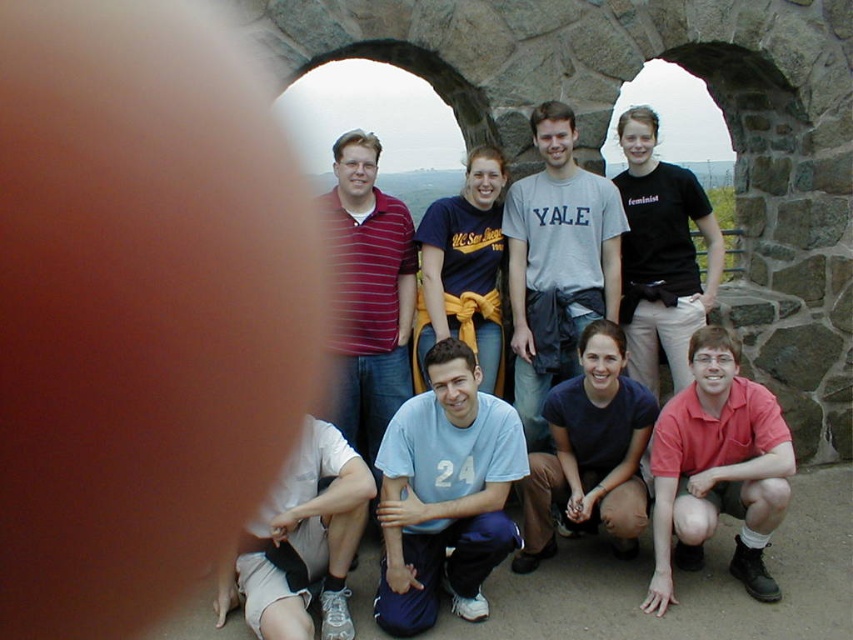
Can you confirm if red cotton shirt at lower right is bigger than black matte shirt at upper center?

Correct, red cotton shirt at lower right is larger in size than black matte shirt at upper center.

The image size is (853, 640). Describe the element at coordinates (717, 468) in the screenshot. I see `red cotton shirt at lower right` at that location.

You are a GUI agent. You are given a task and a screenshot of the screen. Output one action in this format:
    pyautogui.click(x=<x>, y=<y>)
    Task: Click on the red cotton shirt at lower right
    This screenshot has height=640, width=853.
    Given the screenshot: What is the action you would take?
    pyautogui.click(x=717, y=468)

This screenshot has width=853, height=640. In order to click on red cotton shirt at lower right in this screenshot , I will do coord(717,468).

Who is positioned more to the left, light blue t-shirt at center or light blue t-shirt at lower center?

From the viewer's perspective, light blue t-shirt at center appears more on the left side.

Find the location of `light blue t-shirt at center`. light blue t-shirt at center is located at coordinates (445, 493).

Which of these two, light blue t-shirt at center or striped cotton shirt at center, stands shorter?

light blue t-shirt at center is shorter.

Where is `light blue t-shirt at center`? Image resolution: width=853 pixels, height=640 pixels. light blue t-shirt at center is located at coordinates (445, 493).